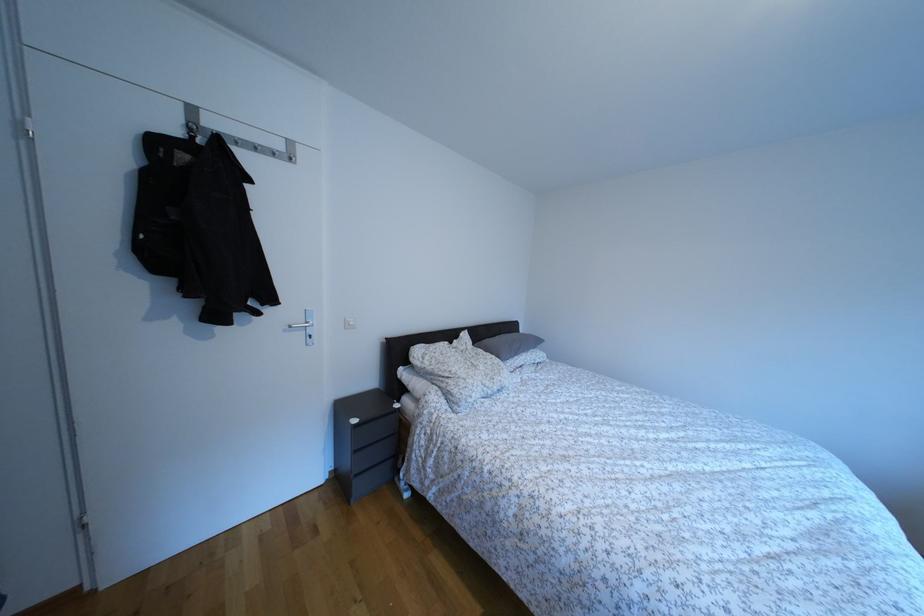
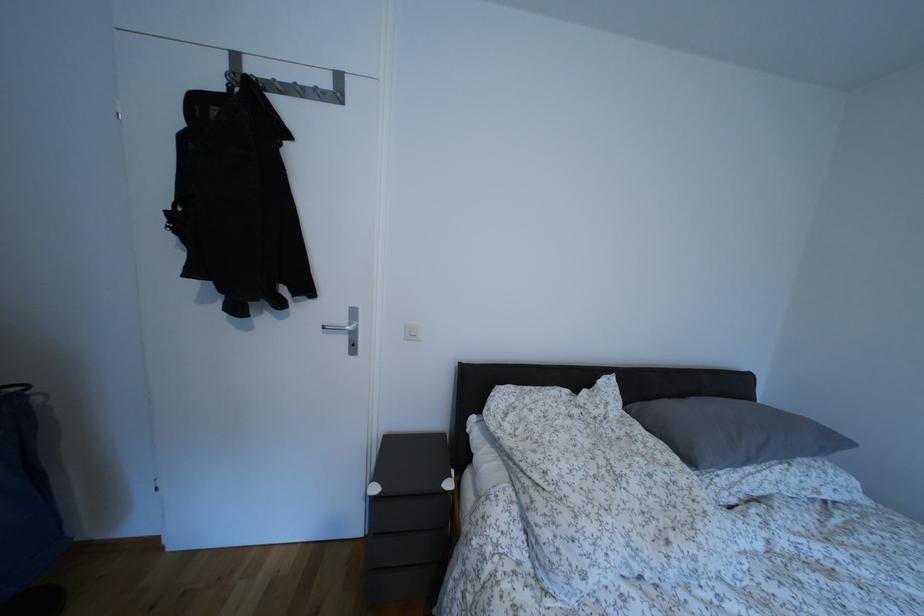
Question: The camera is either moving clockwise (left) or counter-clockwise (right) around the object. The first image is from the beginning of the video and the second image is from the end. Is the camera moving left or right when shooting the video?

Choices:
 (A) Left
 (B) Right

Answer: (B)